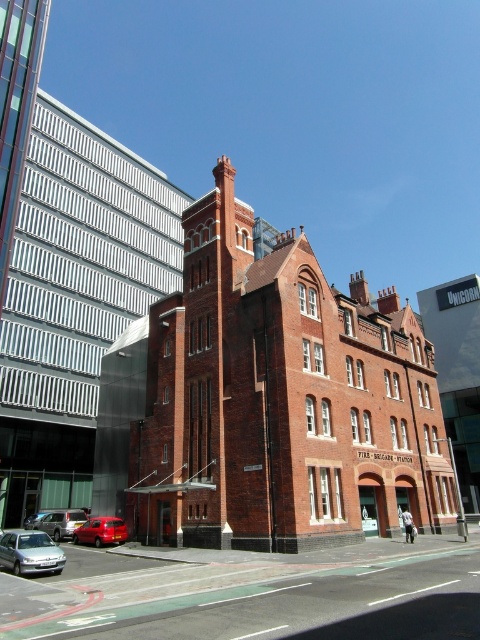
You are a delivery driver who needs to park your vehicle in a tight space near the fire station. You see a silver metallic sedan at lower left and a silver metallic car at center. Which vehicle should you choose to park in the space if you need the smallest possible size?

The silver metallic sedan at lower left is smaller than the silver metallic car at center, so you should choose the silver metallic sedan at lower left to park in the tight space.

You are standing in front of the red brick fire station and want to determine the relative positions of two points marked on the building. Which of the two points, point 1 at coordinates point (x=47, y=536) or point 2 at coordinates point (x=99, y=531), is closer to you?

Point 1 at coordinates point (x=47, y=536) is closer to the viewer than point 2 at coordinates point (x=99, y=531).